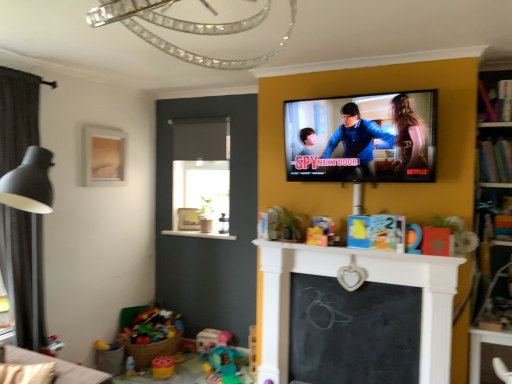
Where is `vacant space to the right of translucent plastic cup at lower left, acting as the fourth toy starting from the right`? vacant space to the right of translucent plastic cup at lower left, acting as the fourth toy starting from the right is located at coordinates (151, 377).